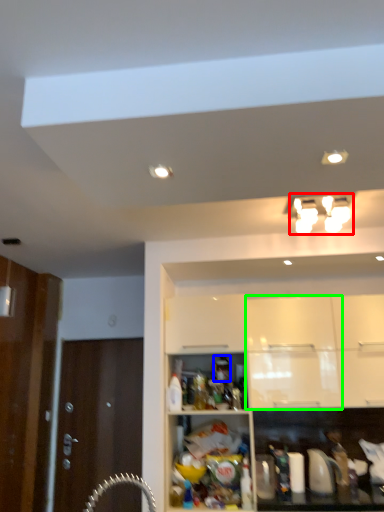
Question: Which is farther away from light fixture (highlighted by a red box)? beverage (highlighted by a blue box) or cabinetry (highlighted by a green box)?

Choices:
 (A) beverage
 (B) cabinetry

Answer: (A)